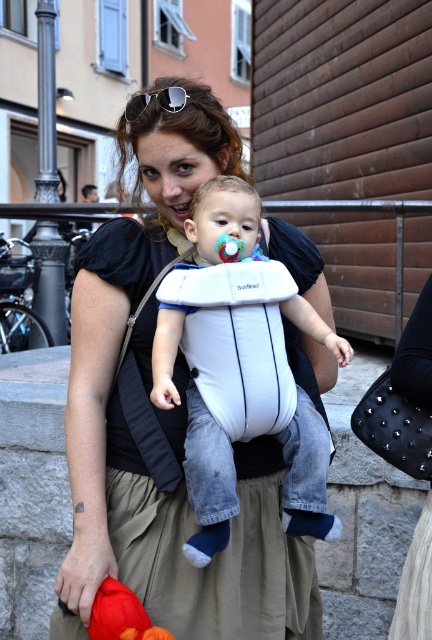
Question: Does white fabric baby carrier at center appear over rubber/soft pacifier at center?

Choices:
 (A) yes
 (B) no

Answer: (B)

Question: Does white fabric baby carrier at center appear on the left side of metallic reflective sunglasses at upper center?

Choices:
 (A) no
 (B) yes

Answer: (A)

Question: Among these objects, which one is farthest from the camera?

Choices:
 (A) rubber/soft pacifier at center
 (B) white fabric baby carrier at center

Answer: (A)

Question: Is white fabric baby carrier at center to the left of metallic reflective sunglasses at upper center from the viewer's perspective?

Choices:
 (A) no
 (B) yes

Answer: (A)

Question: Which of the following is the closest to the observer?

Choices:
 (A) tap(237, 244)
 (B) tap(162, 97)

Answer: (A)

Question: Based on their relative distances, which object is farther from the velvety orange toy at lower left?

Choices:
 (A) white fabric baby carrier at center
 (B) matte black shirt at center
 (C) rubber/soft pacifier at center
 (D) metallic reflective sunglasses at upper center

Answer: (D)